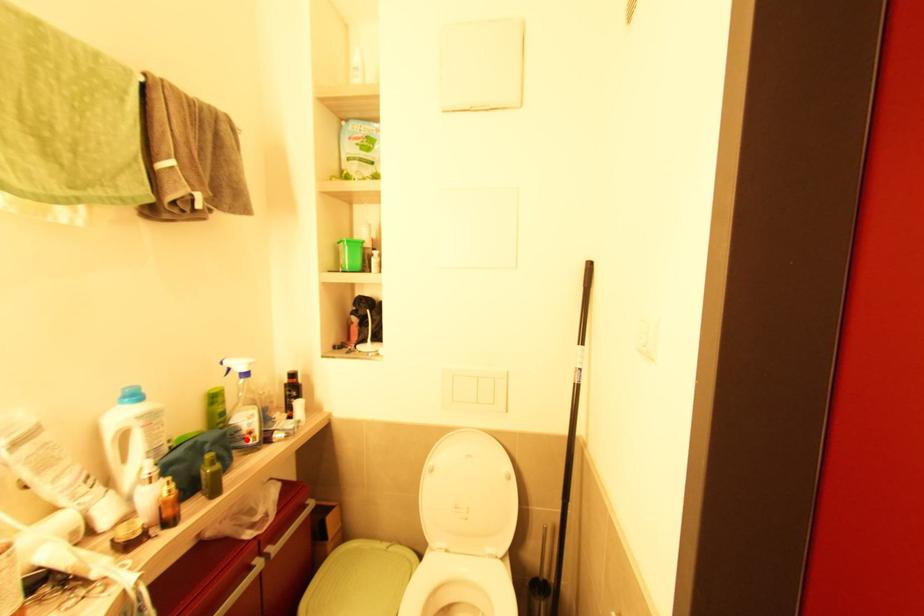
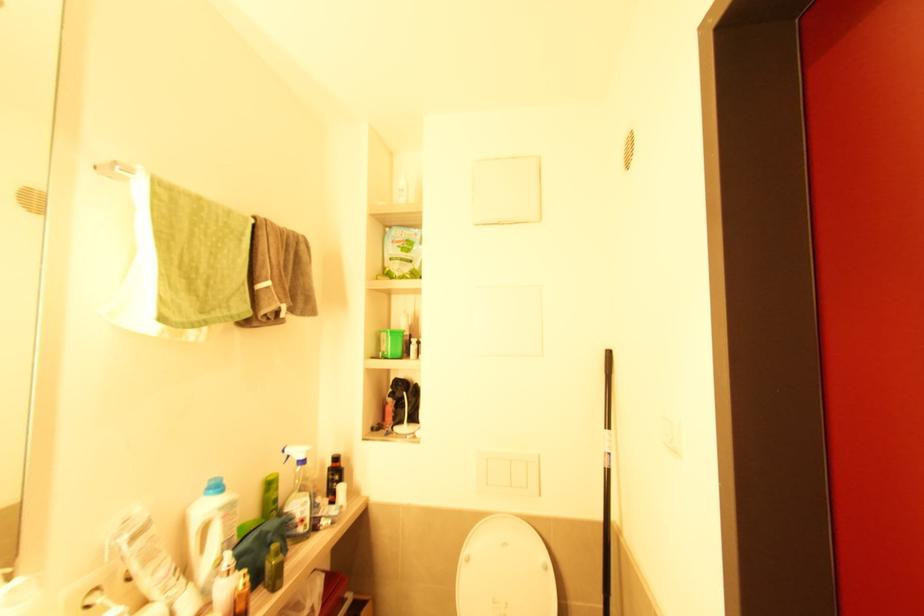
The point at the highlighted location is marked in the first image. Where is the corresponding point in the second image?

(298, 527)